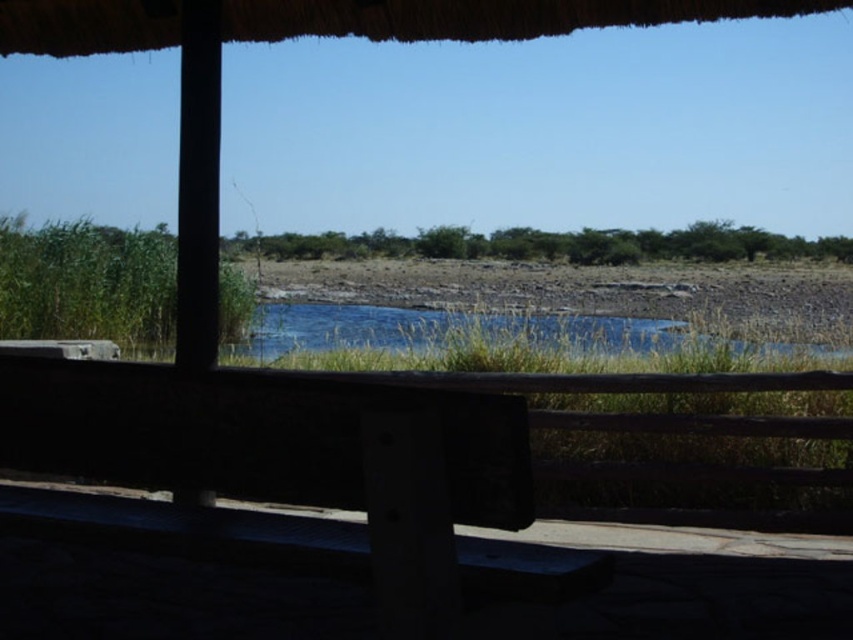
Based on the photo, you are sitting on the wooden bench at center and want to walk to the edge of the blue grassy river at center. Which direction should you move to reach the river?

The wooden bench at center is positioned on the left side of blue grassy river at center, so you should move to the right to reach the river.